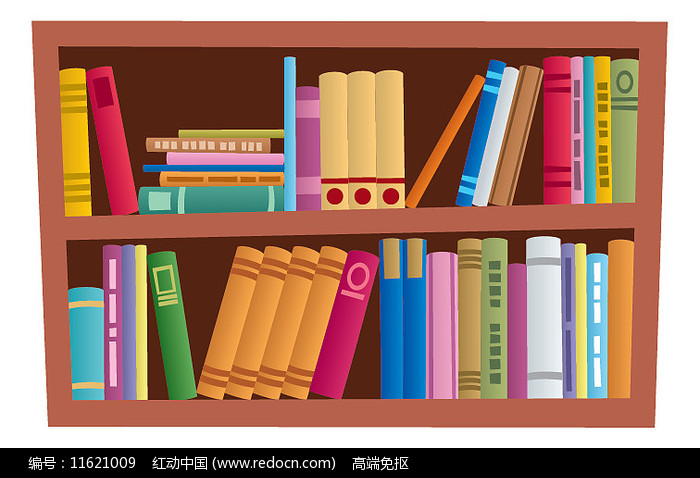
Find the location of a particular element. The image size is (700, 478). blue books is located at coordinates (390, 316), (413, 319), (479, 143), (588, 148), (605, 285), (286, 128), (97, 319).